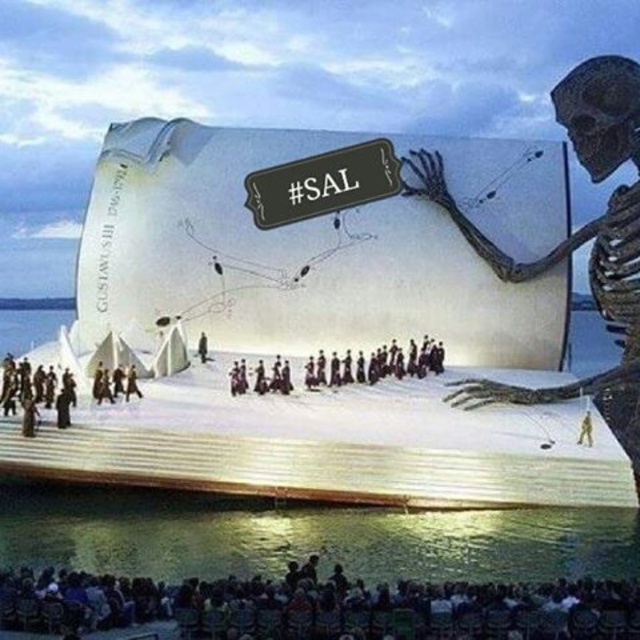
Question: From the image, what is the correct spatial relationship of dark brown uniform at center in relation to dark brown leather jacket at center?

Choices:
 (A) left
 (B) right

Answer: (B)

Question: Can you confirm if clear water at stage bottom is positioned to the right of dark brown uniform at center?

Choices:
 (A) yes
 (B) no

Answer: (B)

Question: Which object is farther from the camera taking this photo?

Choices:
 (A) dark brown leather jacket at center
 (B) dark brown uniform at center

Answer: (A)

Question: Can you confirm if black fabric at lower center is positioned below dark brown leather coat at lower left?

Choices:
 (A) yes
 (B) no

Answer: (A)

Question: Which object is closer to the camera taking this photo?

Choices:
 (A) clear water at stage bottom
 (B) black fabric at lower center

Answer: (B)

Question: Estimate the real-world distances between objects in this image. Which object is farther from the black fabric at lower center?

Choices:
 (A) dark brown leather jacket at center
 (B) clear water at stage bottom

Answer: (A)